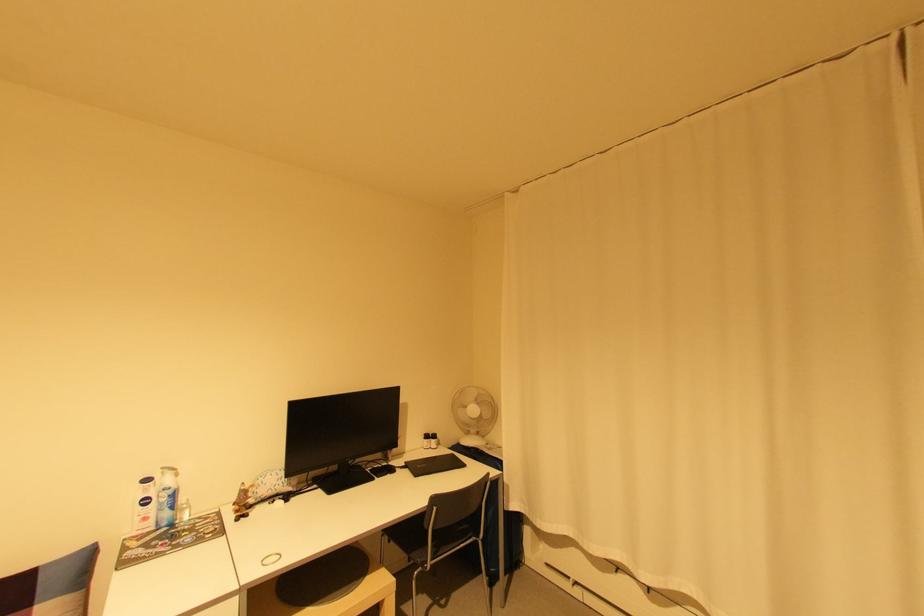
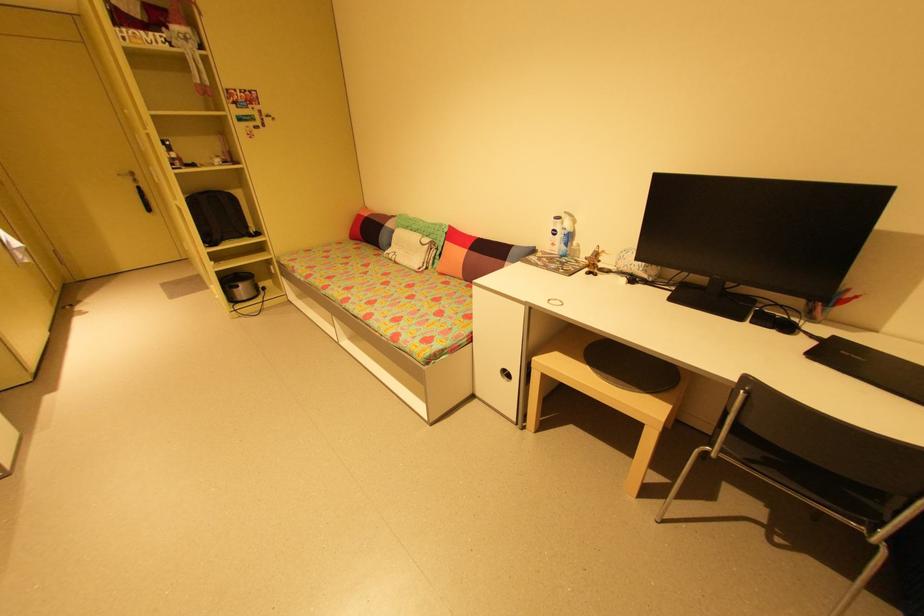
Where in the second image is the point corresponding to (x=178, y=496) from the first image?

(574, 237)